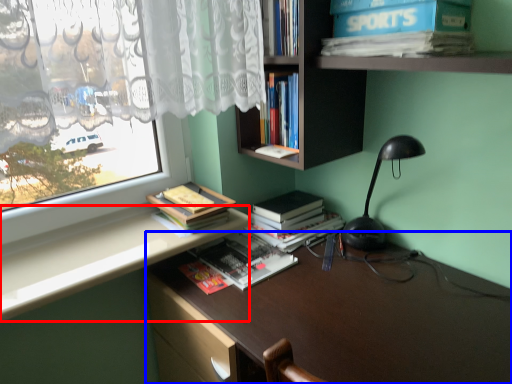
Question: Which object is closer to the camera taking this photo, counter top (highlighted by a red box) or desk (highlighted by a blue box)?

Choices:
 (A) counter top
 (B) desk

Answer: (B)